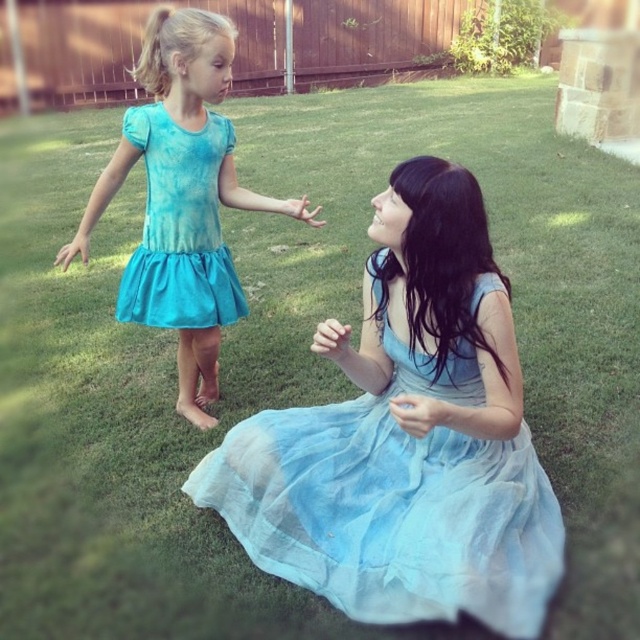
You are a photographer trying to capture a photo of both the light blue sheer dress at center and the turquoise fabric dress at left. Since you want them both in the frame, which direction should you move to ensure both dresses are visible?

You should move to the left to ensure both the light blue sheer dress at center and the turquoise fabric dress at left are visible, as the light blue sheer dress at center is positioned to the right of the turquoise fabric dress at left.